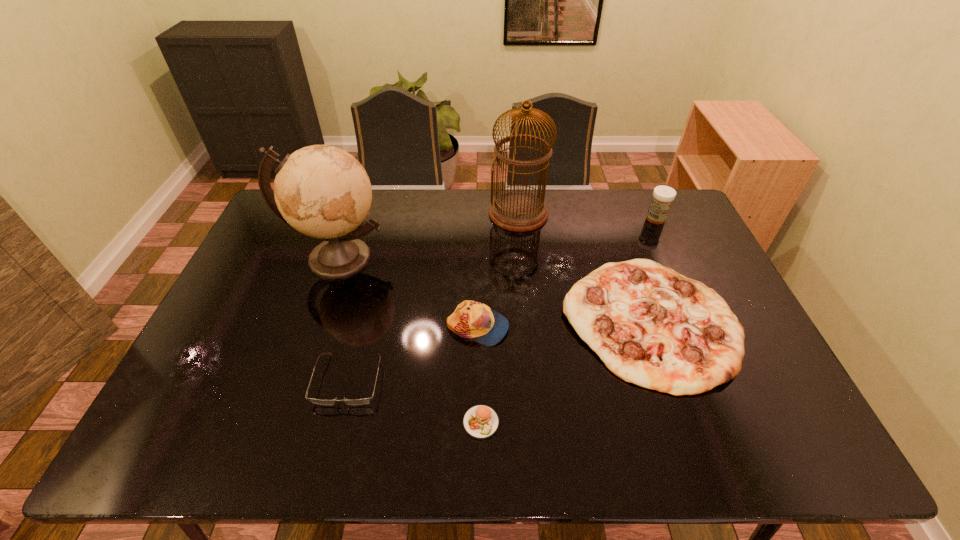
Where is `empty space between the second shortest object and the fifth shortest object`? This screenshot has height=540, width=960. empty space between the second shortest object and the fifth shortest object is located at coordinates pyautogui.click(x=502, y=299).

Identify the location of vacant space that is in between the birdcage and the medicine. (588, 216).

This screenshot has width=960, height=540. What are the coordinates of `free spot between the spectacles and the cap` in the screenshot? It's located at (413, 353).

I want to click on blank region between the globe and the medicine, so click(497, 238).

This screenshot has width=960, height=540. Identify the location of vacant region between the birdcage and the fourth shortest object. (498, 271).

At what (x,y) coordinates should I click in order to perform the action: click on free space between the globe and the fourth tallest object. Please return your answer as a coordinate pair (x, y). This screenshot has height=540, width=960. Looking at the image, I should click on (408, 293).

You are a GUI agent. You are given a task and a screenshot of the screen. Output one action in this format:
    pyautogui.click(x=<x>, y=<y>)
    Task: Click on the vacant area that lies between the birdcage and the pizza
    The image size is (960, 540).
    Given the screenshot: What is the action you would take?
    pyautogui.click(x=584, y=267)

Locate which object is the second closest to the second shortest object. Please provide its 2D coordinates. Your answer should be formatted as a tuple, i.e. [(x, y)], where the tuple contains the x and y coordinates of a point satisfying the conditions above.

[(481, 422)]

Identify the location of object identified as the third closest to the fourth shortest object. This screenshot has width=960, height=540. click(x=481, y=422).

Locate an element on the screen. This screenshot has height=540, width=960. free spot that satisfies the following two spatial constraints: 1. on the back side of the fifth shortest object; 2. on the right side of the pizza is located at coordinates (613, 219).